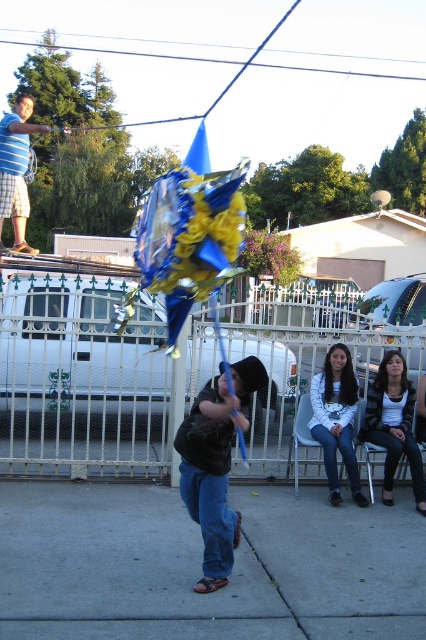
Question: Which of the following is the farthest from the observer?

Choices:
 (A) gray concrete pavement at center
 (B) denim jeans at lower right

Answer: (B)

Question: Does white metal fence at center have a smaller size compared to striped sweater at lower right?

Choices:
 (A) yes
 (B) no

Answer: (B)

Question: Which object is closer to the camera taking this photo?

Choices:
 (A) brushed metal water at bottle left
 (B) striped sweater at lower right
 (C) gray concrete pavement at center
 (D) white metal fence at center

Answer: (C)

Question: Where is gray concrete pavement at center located in relation to white metal fence at center in the image?

Choices:
 (A) right
 (B) left

Answer: (B)

Question: In this image, where is white metal fence at center located relative to brushed metal water at bottle left?

Choices:
 (A) left
 (B) right

Answer: (B)

Question: Which point is farther from the camera taking this photo?

Choices:
 (A) (374, 388)
 (B) (11, 198)
 (C) (345, 344)

Answer: (B)